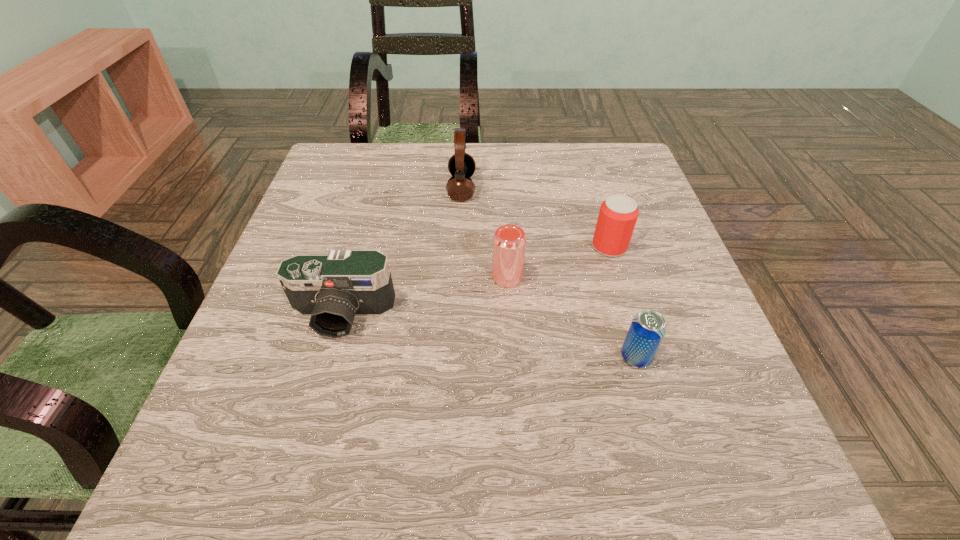
I want to click on empty location between the farthest beer can and the leftmost object, so click(x=476, y=281).

Identify which object is the second nearest to the farthest object. Please provide its 2D coordinates. Your answer should be formatted as a tuple, i.e. [(x, y)], where the tuple contains the x and y coordinates of a point satisfying the conditions above.

[(618, 214)]

Where is `the closest object to the leftmost object`? This screenshot has width=960, height=540. the closest object to the leftmost object is located at coordinates (509, 241).

You are a GUI agent. You are given a task and a screenshot of the screen. Output one action in this format:
    pyautogui.click(x=<x>, y=<y>)
    Task: Click on the beer can object that ranks as the second closest to the farthest beer can
    
    Given the screenshot: What is the action you would take?
    pyautogui.click(x=648, y=328)

Select which beer can is the closest to the nearest object. Please provide its 2D coordinates. Your answer should be formatted as a tuple, i.e. [(x, y)], where the tuple contains the x and y coordinates of a point satisfying the conditions above.

[(509, 241)]

You are a GUI agent. You are given a task and a screenshot of the screen. Output one action in this format:
    pyautogui.click(x=<x>, y=<y>)
    Task: Click on the vacant area that satisfies the following two spatial constraints: 1. on the ear pads of the tallest object; 2. on the front-facing side of the leftmost object
    This screenshot has width=960, height=540.
    Given the screenshot: What is the action you would take?
    pyautogui.click(x=455, y=315)

I want to click on free location that satisfies the following two spatial constraints: 1. on the ear pads of the fourth object from right to left; 2. on the back side of the second farthest object, so click(459, 247).

Find the location of a particular element. This screenshot has width=960, height=540. vacant space that satisfies the following two spatial constraints: 1. on the back side of the nearest beer can; 2. on the right side of the second farthest object is located at coordinates (604, 247).

Identify the location of free space in the image that satisfies the following two spatial constraints: 1. on the ear pads of the tallest object; 2. on the back side of the second nearest beer can. Image resolution: width=960 pixels, height=540 pixels. (457, 277).

This screenshot has width=960, height=540. In order to click on free spot that satisfies the following two spatial constraints: 1. on the back side of the nearest beer can; 2. on the left side of the farthest beer can in this screenshot , I will do point(604,247).